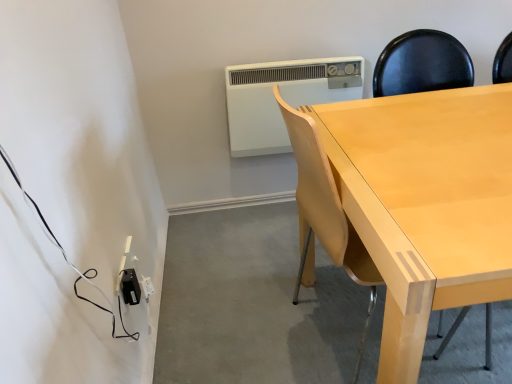
This screenshot has height=384, width=512. Describe the element at coordinates (130, 287) in the screenshot. I see `black plastic power adapter at lower left` at that location.

Find the location of a particular element. The image size is (512, 384). light wood chair at center is located at coordinates (326, 207).

Is white plastic air conditioning unit at upper center directly adjacent to light wood chair at center?

They are not placed beside each other.

Does point (272, 80) come farther from viewer compared to point (301, 187)?

Yes, it is.

Between white plastic air conditioning unit at upper center and light wood chair at center, which one is positioned behind?

Positioned behind is white plastic air conditioning unit at upper center.

Considering the sizes of white plastic air conditioning unit at upper center and light wood chair at center in the image, is white plastic air conditioning unit at upper center taller or shorter than light wood chair at center?

In the image, white plastic air conditioning unit at upper center appears to be shorter than light wood chair at center.

Is light wood chair at center oriented away from white plastic air conditioning unit at upper center?

light wood chair at center does not have its back to white plastic air conditioning unit at upper center.

Is point (287, 117) closer or farther from the camera than point (316, 79)?

Clearly, point (287, 117) is closer to the camera than point (316, 79).

From a real-world perspective, is light wood chair at center physically located above or below white plastic air conditioning unit at upper center?

light wood chair at center is situated lower than white plastic air conditioning unit at upper center in the real world.

In the scene shown: Between black plastic power adapter at lower left and light wood chair at center, which one has larger width?

light wood chair at center.

Consider the image. Measure the distance from black plastic power adapter at lower left to light wood chair at center.

25.02 inches.

Considering the sizes of objects black plastic power adapter at lower left and light wood chair at center in the image provided, who is taller, black plastic power adapter at lower left or light wood chair at center?

With more height is light wood chair at center.

Which is further, (127,287) or (285,110)?

The point (127,287) is farther.

Considering the positions of objects white plastic air conditioning unit at upper center and black plastic power adapter at lower left in the image provided, who is behind, white plastic air conditioning unit at upper center or black plastic power adapter at lower left?

white plastic air conditioning unit at upper center is more distant.

Does white plastic air conditioning unit at upper center appear on the left side of black plastic power adapter at lower left?

Incorrect, white plastic air conditioning unit at upper center is not on the left side of black plastic power adapter at lower left.

Does white plastic air conditioning unit at upper center touch black plastic power adapter at lower left?

There is a gap between white plastic air conditioning unit at upper center and black plastic power adapter at lower left.

Consider the image. Can we say white plastic air conditioning unit at upper center lies outside black plastic power adapter at lower left?

Yes, white plastic air conditioning unit at upper center is not within black plastic power adapter at lower left.

Where is `chair on the right of black plastic power adapter at lower left`? This screenshot has height=384, width=512. chair on the right of black plastic power adapter at lower left is located at coordinates (326, 207).

Does light wood chair at center turn towards black plastic power adapter at lower left?

No, light wood chair at center does not turn towards black plastic power adapter at lower left.

Looking at this image, can you confirm if light wood chair at center is shorter than black plastic power adapter at lower left?

Incorrect, the height of light wood chair at center does not fall short of that of black plastic power adapter at lower left.

Is black plastic power adapter at lower left far from white plastic air conditioning unit at upper center?

Yes, black plastic power adapter at lower left and white plastic air conditioning unit at upper center are located far from each other.

What's the angular difference between black plastic power adapter at lower left and white plastic air conditioning unit at upper center's facing directions?

There is a 87-degree angle between the facing directions of black plastic power adapter at lower left and white plastic air conditioning unit at upper center.

Considering the positions of points (127, 280) and (267, 146), is point (127, 280) farther from camera compared to point (267, 146)?

That is False.

Could you tell me if black plastic power adapter at lower left is turned towards white plastic air conditioning unit at upper center?

No, black plastic power adapter at lower left is not facing towards white plastic air conditioning unit at upper center.

What are the coordinates of `chair located on the right of white plastic air conditioning unit at upper center` in the screenshot? It's located at (326, 207).

Identify the location of air conditioning lying above the light wood chair at center (from the image's perspective). (283, 98).

From the image, which object appears to be farther from black plastic power adapter at lower left, white plastic air conditioning unit at upper center or light wood chair at center?

Based on the image, white plastic air conditioning unit at upper center appears to be further to black plastic power adapter at lower left.

Considering their positions, is white plastic air conditioning unit at upper center positioned closer to light wood chair at center than black plastic power adapter at lower left?

black plastic power adapter at lower left lies closer to light wood chair at center than the other object.

Based on their spatial positions, is black plastic power adapter at lower left or light wood chair at center further from white plastic air conditioning unit at upper center?

black plastic power adapter at lower left.

Based on their spatial positions, is black plastic power adapter at lower left or white plastic air conditioning unit at upper center closer to light wood chair at center?

Based on the image, black plastic power adapter at lower left appears to be nearer to light wood chair at center.

In the scene shown: When comparing their distances from white plastic air conditioning unit at upper center, does light wood chair at center or black plastic power adapter at lower left seem further?

black plastic power adapter at lower left is positioned further to the anchor white plastic air conditioning unit at upper center.

Based on their spatial positions, is light wood chair at center or white plastic air conditioning unit at upper center further from black plastic power adapter at lower left?

Based on the image, white plastic air conditioning unit at upper center appears to be further to black plastic power adapter at lower left.

Image resolution: width=512 pixels, height=384 pixels. In order to click on electric outlet between light wood chair at center and white plastic air conditioning unit at upper center from front to back in this screenshot , I will do `click(130, 287)`.